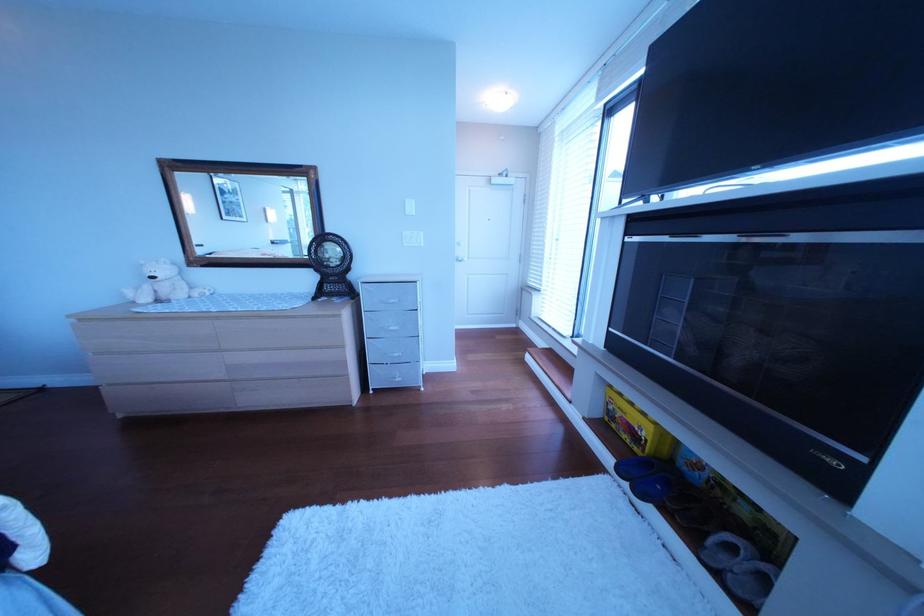
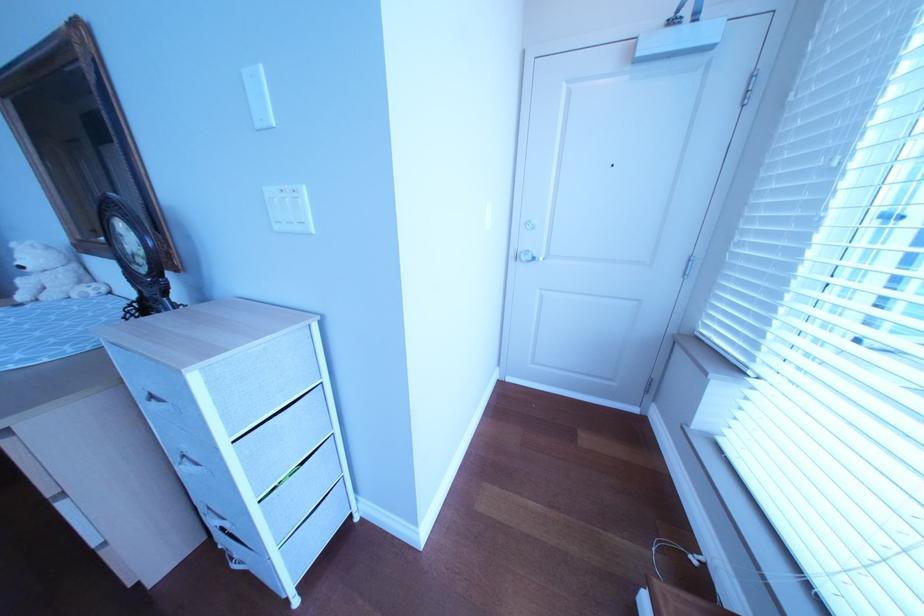
Locate, in the second image, the point that corresponds to [168,280] in the first image.

(37, 270)